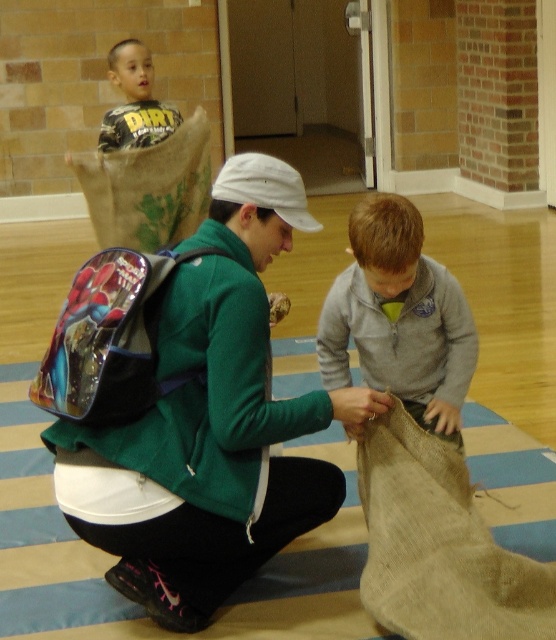
You are a photographer standing in the room. You want to take a photo that includes both the shiny blue backpack at center and the matte yellow shirt at upper left. Which object should you position closer to the camera to ensure both are fully visible in the frame?

Since the shiny blue backpack at center is shorter than the matte yellow shirt at upper left, you should position the shiny blue backpack at center closer to the camera to ensure both objects are fully visible in the frame.

You are a student who needs to choose a backpack to carry your books. You see a green fabric backpack at center and a shiny blue backpack at center. Which backpack is wider?

The green fabric backpack at center is wider than the shiny blue backpack at center.

You are standing at the origin point in the room. Where is the green fabric backpack at center located in terms of coordinates?

The green fabric backpack at center is located at coordinates 0.661 on the x axis and 0.378 on the y axis.